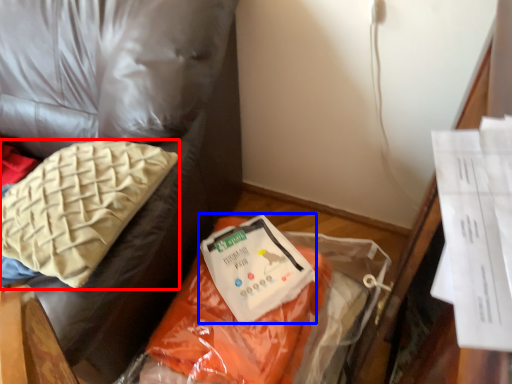
Question: Which of the following is the closest to the observer, pillow (highlighted by a red box) or wrap (highlighted by a blue box)?

Choices:
 (A) pillow
 (B) wrap

Answer: (A)